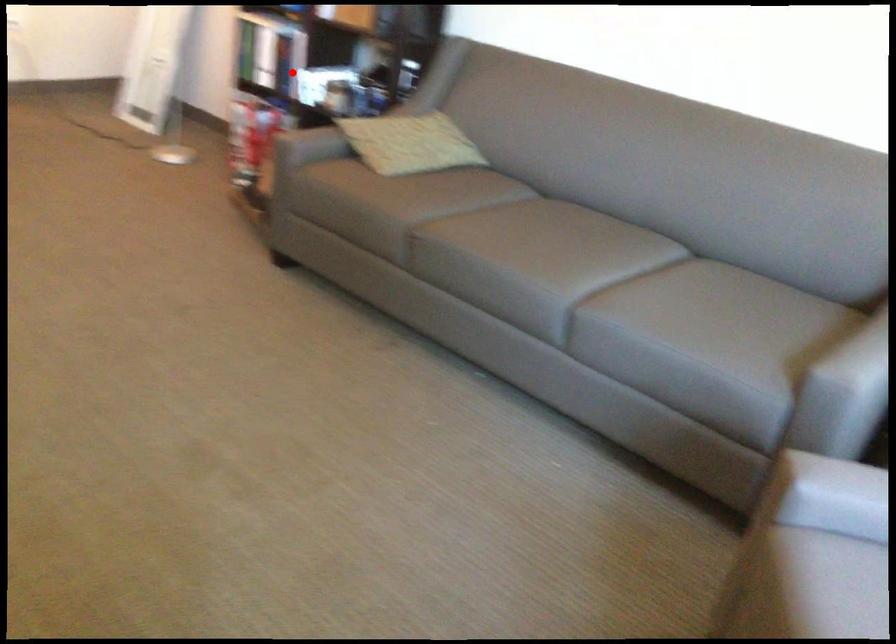
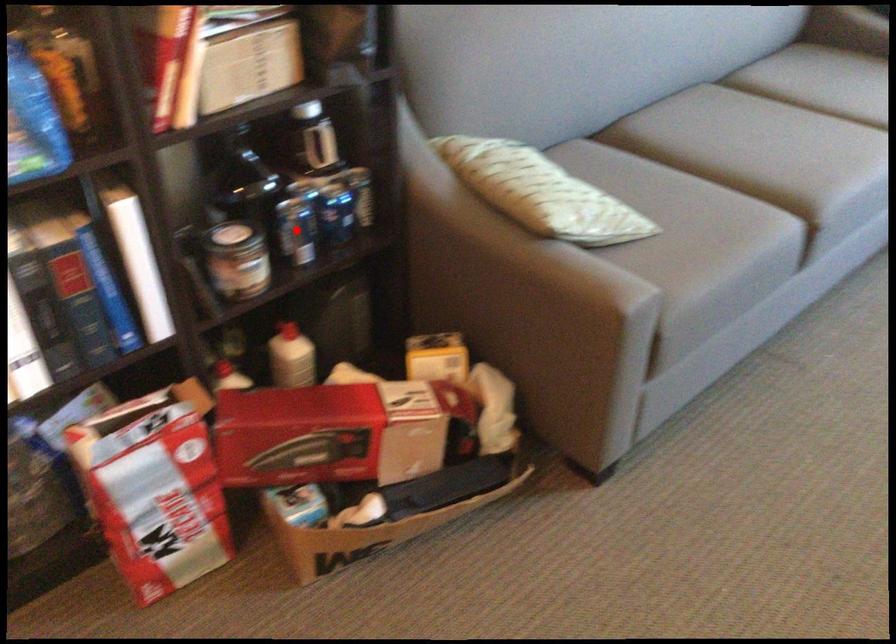
I am providing you with two images of the same scene from different viewpoints. A red point is marked on the first image and another point is marked on the second image. Is the red point in image1 aligned with the point shown in image2?

No